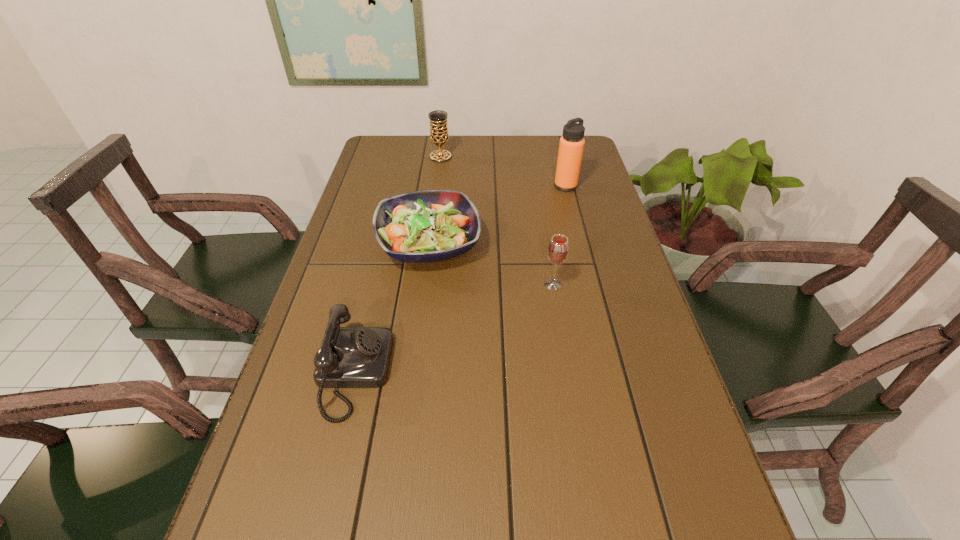
I want to click on free space between the rightmost object and the salad plate, so click(x=497, y=215).

Identify the location of free space between the telephone and the chalice. (397, 265).

Identify the location of vacant space in between the salad plate and the tallest object. Image resolution: width=960 pixels, height=540 pixels. (497, 215).

Locate an element on the screen. Image resolution: width=960 pixels, height=540 pixels. vacant area between the wineglass and the farthest object is located at coordinates click(497, 220).

I want to click on free space between the telephone and the salad plate, so click(392, 308).

Point out which object is positioned as the second nearest to the thermos bottle. Please provide its 2D coordinates. Your answer should be formatted as a tuple, i.e. [(x, y)], where the tuple contains the x and y coordinates of a point satisfying the conditions above.

[(439, 135)]

Locate an element on the screen. The image size is (960, 540). object that ranks as the fourth closest to the fourth object from left to right is located at coordinates (439, 135).

This screenshot has width=960, height=540. What are the coordinates of `vacant position in the image that satisfies the following two spatial constraints: 1. on the front side of the salad plate; 2. on the right side of the second object from right to left` in the screenshot? It's located at (424, 284).

The width and height of the screenshot is (960, 540). I want to click on vacant space that satisfies the following two spatial constraints: 1. on the back side of the second object from right to left; 2. on the left side of the thermos bottle, so click(537, 186).